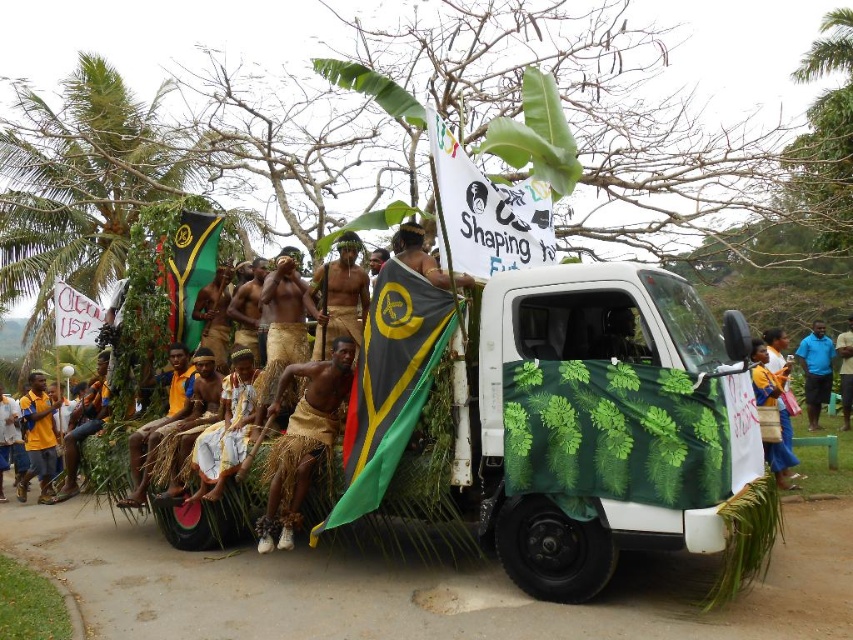
You are a photographer standing at the dirt path where the white pickup truck is parked. You want to take a photo of the brown textured skin at center and the green leafy banana tree at left. Considering your camera can only focus on objects within 10 meters, will both subjects be in focus?

The green leafy banana tree at left is 9.88 meters away from brown textured skin at center. Since the camera can focus within 10 meters, both subjects are within the focus range and will be in focus.

You are a photographer standing in the middle of the dirt path. You want to take a photo of the brown textured skin at center without the green leafy banana tree at left blocking it. What should you do?

The brown textured skin at center is behind the green leafy banana tree at left, so you should move to the side of the dirt path to get a clear shot without the banana tree blocking the view.

From the picture: You are a photographer standing at the camera position. You want to capture a closeup of the white paper banner at upper center. What is the minimum distance you need to move forward to get the banner into focus?

The white paper banner at upper center is 5.04 meters away from the camera. To capture a closeup, you need to move forward until you are within the minimum focusing distance of your camera lens. However, based on the given information, the banner is already 5.04 meters away, so if your lens can focus at that distance or closer, you can adjust your position accordingly. If not, you might need to use a different lens or move closer if possible.